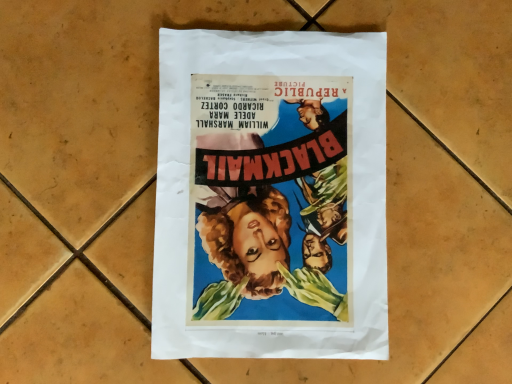
Based on the photo, in order to face vintage paper poster at center, should I rotate leftwards or rightwards?

Rotate your view right by about 2.467°.

At what (x,y) coordinates should I click in order to perform the action: click on vintage paper poster at center. Please return your answer as a coordinate pair (x, y). Looking at the image, I should click on (271, 196).

The image size is (512, 384). Describe the element at coordinates (271, 196) in the screenshot. I see `vintage paper poster at center` at that location.

Where is `vintage paper poster at center`? This screenshot has width=512, height=384. vintage paper poster at center is located at coordinates coord(271,196).